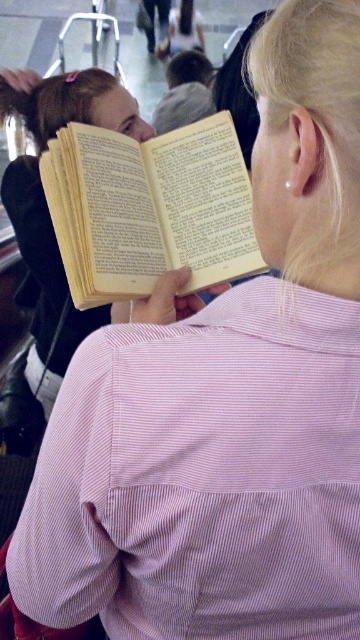
Question: Is pink striped shirt at back thinner than yellow paper book at upper left?

Choices:
 (A) no
 (B) yes

Answer: (B)

Question: Is yellow paper book at center above yellow paper book at upper left?

Choices:
 (A) yes
 (B) no

Answer: (B)

Question: Which point is closer to the camera?

Choices:
 (A) (51, 288)
 (B) (221, 154)
 (C) (330, 305)

Answer: (C)

Question: Which point is farther to the camera?

Choices:
 (A) (87, 120)
 (B) (88, 236)

Answer: (A)

Question: From the image, what is the correct spatial relationship of pink striped shirt at back in relation to yellow paper book at center?

Choices:
 (A) below
 (B) above

Answer: (A)

Question: Which object is closer to the camera taking this photo?

Choices:
 (A) yellow paper book at center
 (B) pink striped shirt at back

Answer: (B)